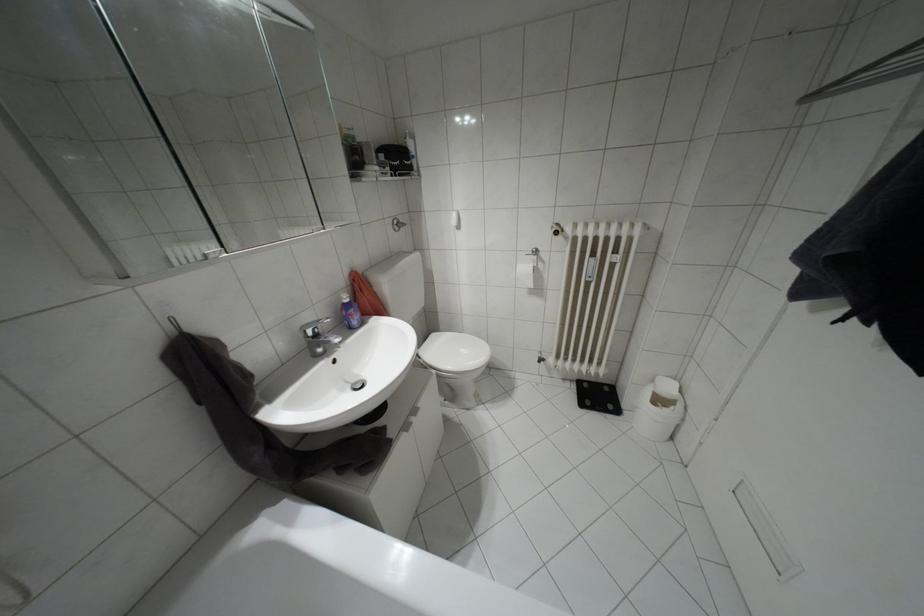
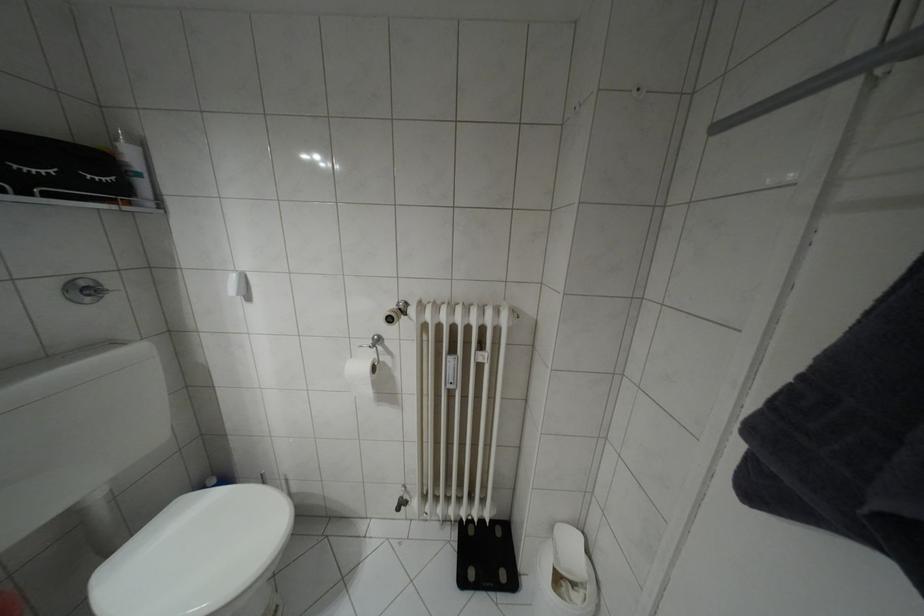
Locate, in the second image, the point that corresponds to point (395, 222) in the first image.

(81, 284)